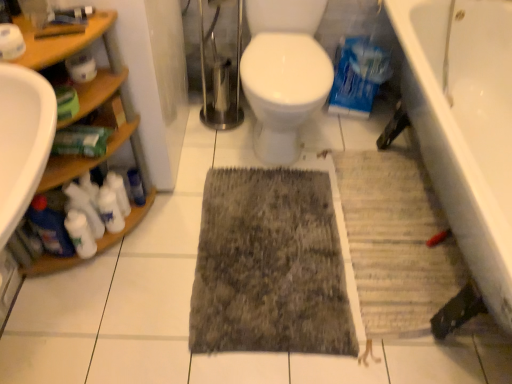
Locate an element on the screen. free space in front of blue glossy bottle at left, the 4th cleaning product viewed from the right is located at coordinates click(x=57, y=295).